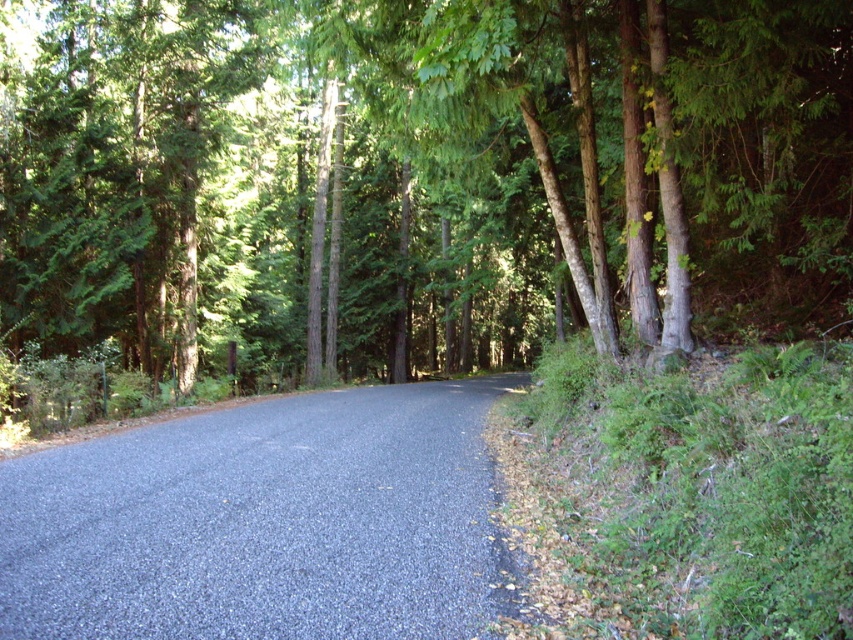
You are driving a car and want to park on the gray asphalt road at center. However, there is a green leafy tree at center. Can you park your car there without hitting the tree?

The green leafy tree at center is positioned over the gray asphalt road at center, so parking there would risk hitting the tree branches or trunk.

You are driving a car and want to know if the gray asphalt road at center is visible from your current position. Considering the green leafy tree at center, can you see the road clearly?

The gray asphalt road at center is behind the green leafy tree at center, so it might be partially or fully obscured by the tree, making it less visible.